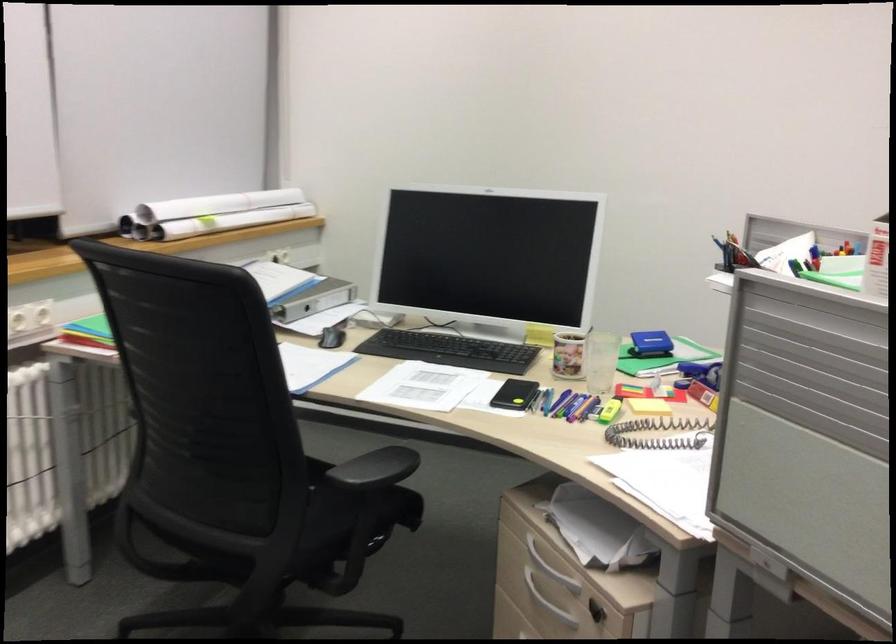
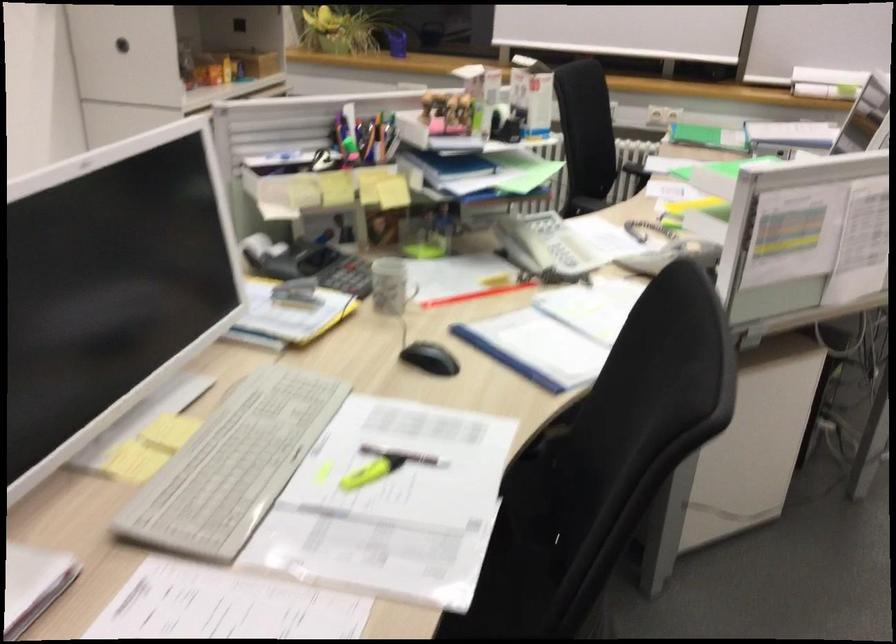
Question: I am providing you with two images of the same scene from different viewpoints. Which of the following objects are not visible in image2?

Choices:
 (A) patterned mug
 (B) blue pen
 (C) white plastic knob
 (D) yellow highlighter pen

Answer: (B)